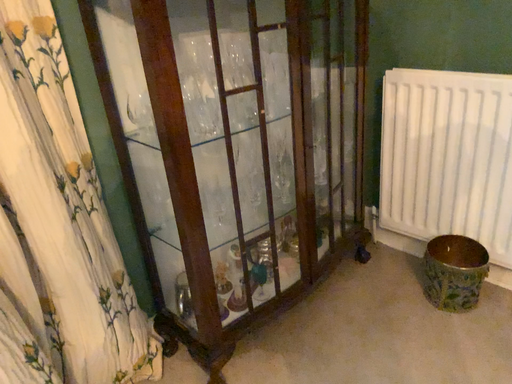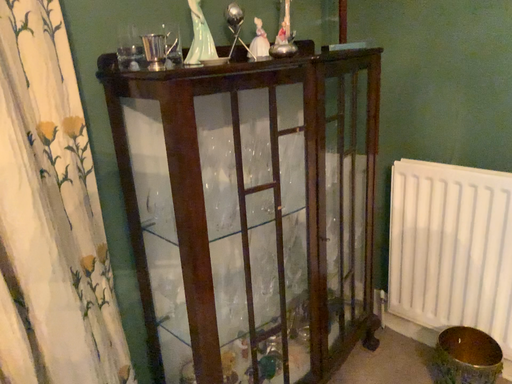
Question: How did the camera likely rotate when shooting the video?

Choices:
 (A) rotated upward
 (B) rotated downward

Answer: (A)